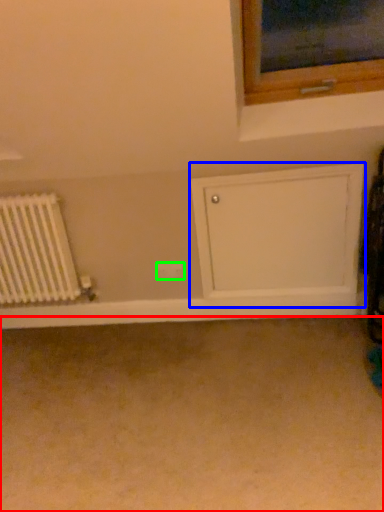
Question: Which is nearer to the plain (highlighted by a red box)? shelf (highlighted by a blue box) or electric outlet (highlighted by a green box).

Choices:
 (A) shelf
 (B) electric outlet

Answer: (A)